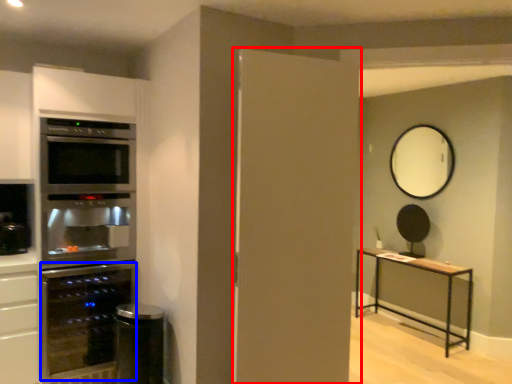
Question: Among these objects, which one is farthest to the camera, door (highlighted by a red box) or appliance (highlighted by a blue box)?

Choices:
 (A) door
 (B) appliance

Answer: (B)